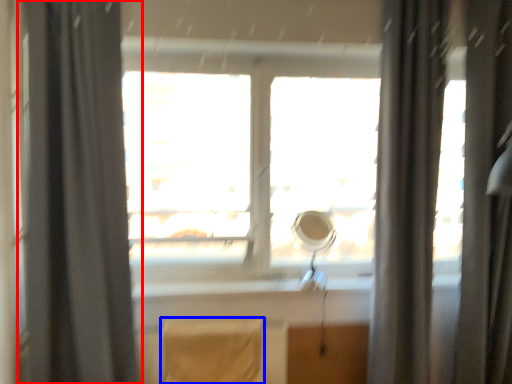
Question: Which of the following is the farthest to the observer, curtain (highlighted by a red box) or chair (highlighted by a blue box)?

Choices:
 (A) curtain
 (B) chair

Answer: (B)